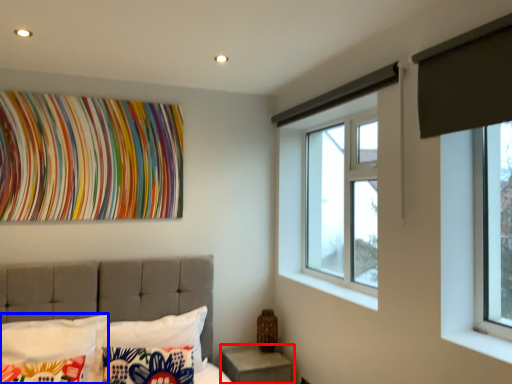
Question: Which point is closer to the camera, nightstand (highlighted by a red box) or pillow (highlighted by a blue box)?

Choices:
 (A) nightstand
 (B) pillow

Answer: (B)